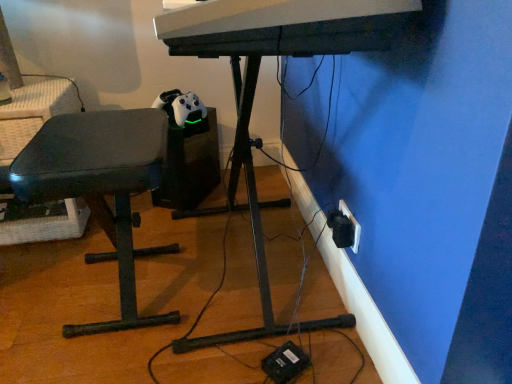
This screenshot has height=384, width=512. I want to click on free spot below matte black bench at left (from a real-world perspective), so click(113, 284).